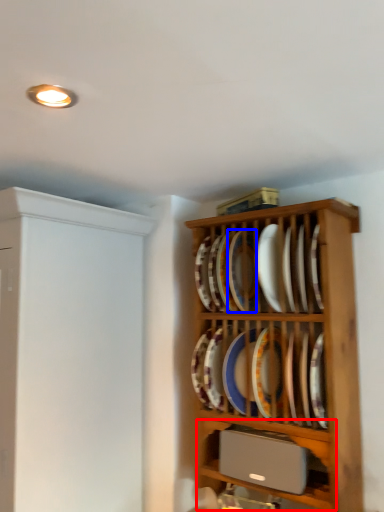
Question: Which object appears farthest to the camera in this image, shelf (highlighted by a red box) or platter (highlighted by a blue box)?

Choices:
 (A) shelf
 (B) platter

Answer: (B)